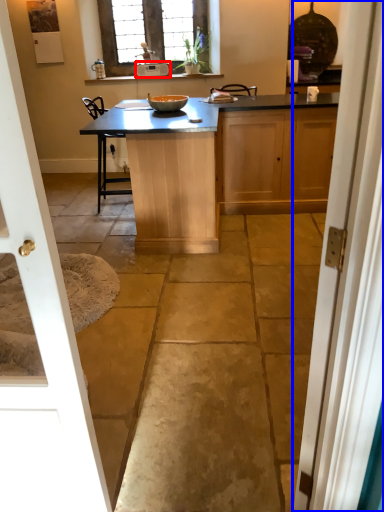
Question: Which of the following is the farthest to the observer, appliance (highlighted by a red box) or door (highlighted by a blue box)?

Choices:
 (A) appliance
 (B) door

Answer: (A)